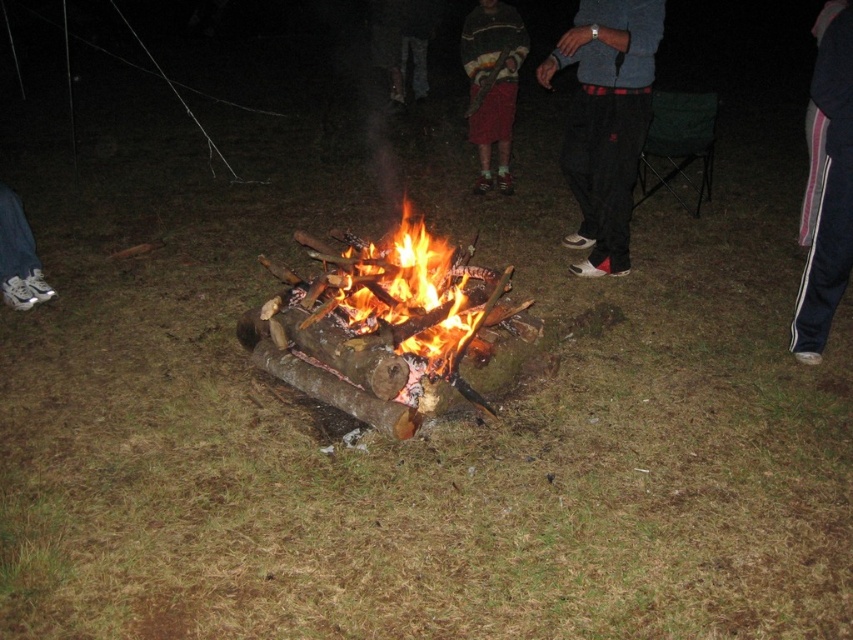
From the picture: Which is above, dark gray pants at center or dark blue jeans at center?

dark blue jeans at center is higher up.

Who is lower down, dark gray pants at center or dark blue jeans at center?

dark gray pants at center is below.

Identify the location of dark gray pants at center. Image resolution: width=853 pixels, height=640 pixels. (605, 120).

Is white sneakers at left above dark blue jeans at center?

Actually, white sneakers at left is below dark blue jeans at center.

Which is in front, point (35, 292) or point (421, 10)?

Positioned in front is point (35, 292).

You are a GUI agent. You are given a task and a screenshot of the screen. Output one action in this format:
    pyautogui.click(x=<x>, y=<y>)
    Task: Click on the white sneakers at left
    This screenshot has width=853, height=640.
    Given the screenshot: What is the action you would take?
    pyautogui.click(x=18, y=257)

Is pink striped pants at lower right positioned before knitted sweater at center?

Yes, pink striped pants at lower right is closer to the viewer.

Between point (842, 76) and point (485, 188), which one is positioned in front?

Positioned in front is point (842, 76).

Find the location of a particular element. This screenshot has width=853, height=640. pink striped pants at lower right is located at coordinates (828, 195).